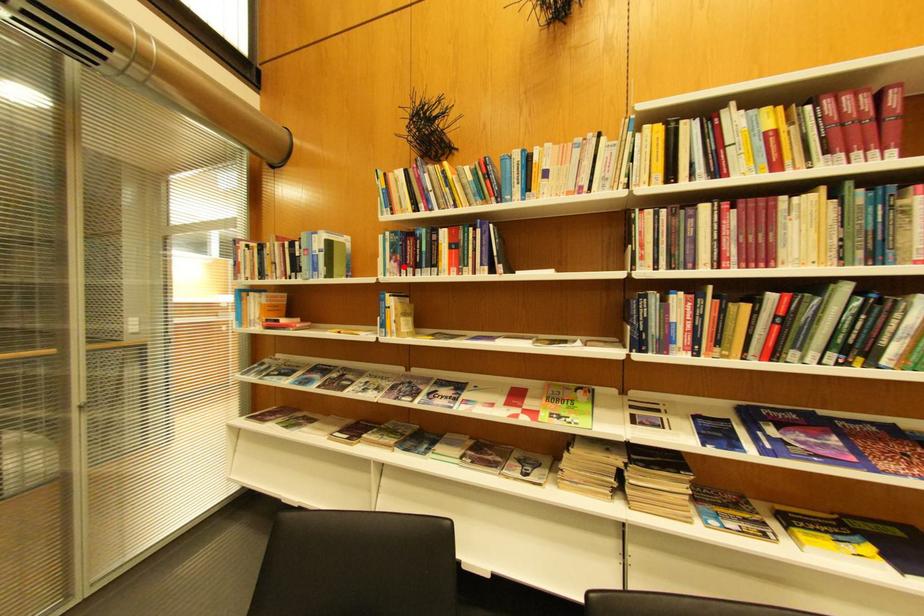
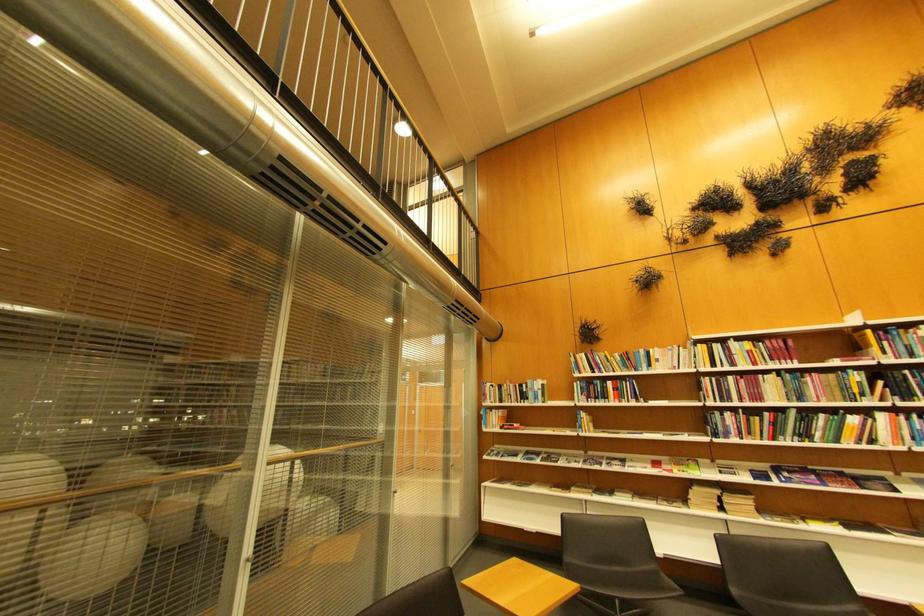
Where in the second image is the point corresponding to the highlighted location from the first image?

(594, 399)